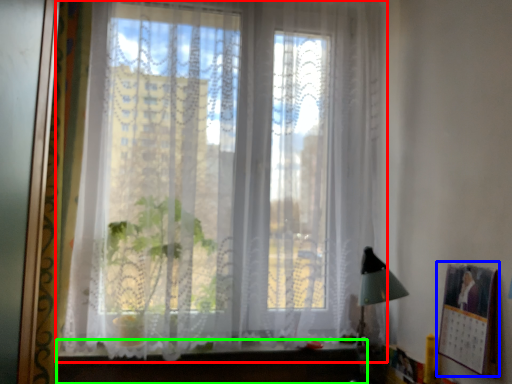
Question: Which is nearer to the window (highlighted by a red box)? picture frame (highlighted by a blue box) or vanity (highlighted by a green box).

Choices:
 (A) picture frame
 (B) vanity

Answer: (B)